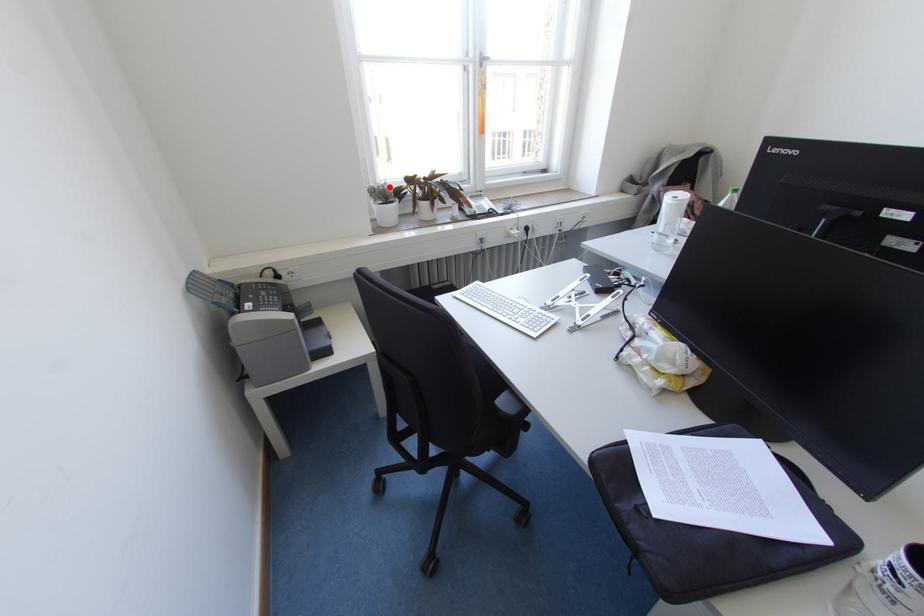
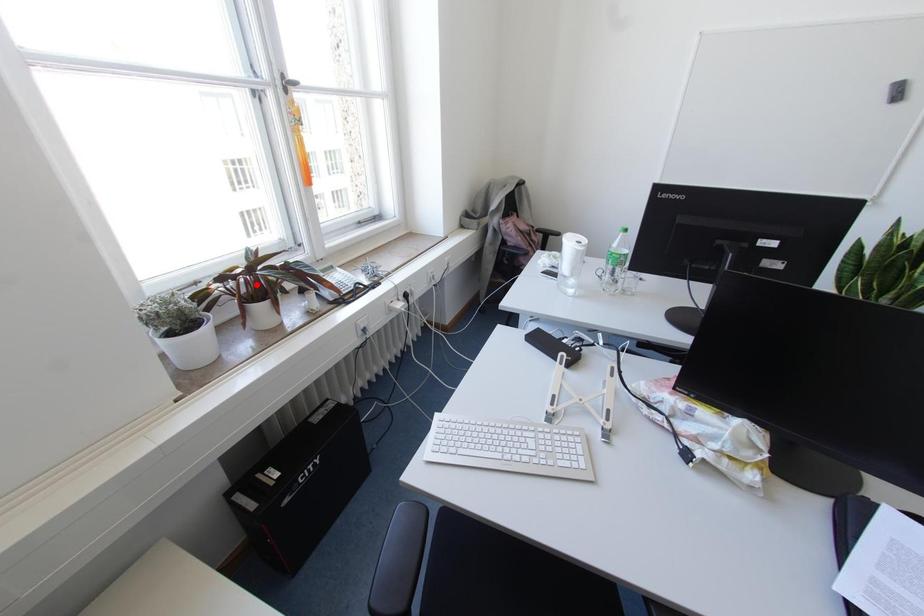
I am providing you with two images of the same scene from different viewpoints. A red point is marked on the first image and another point is marked on the second image. Is the red point in image1 aligned with the point shown in image2?

No